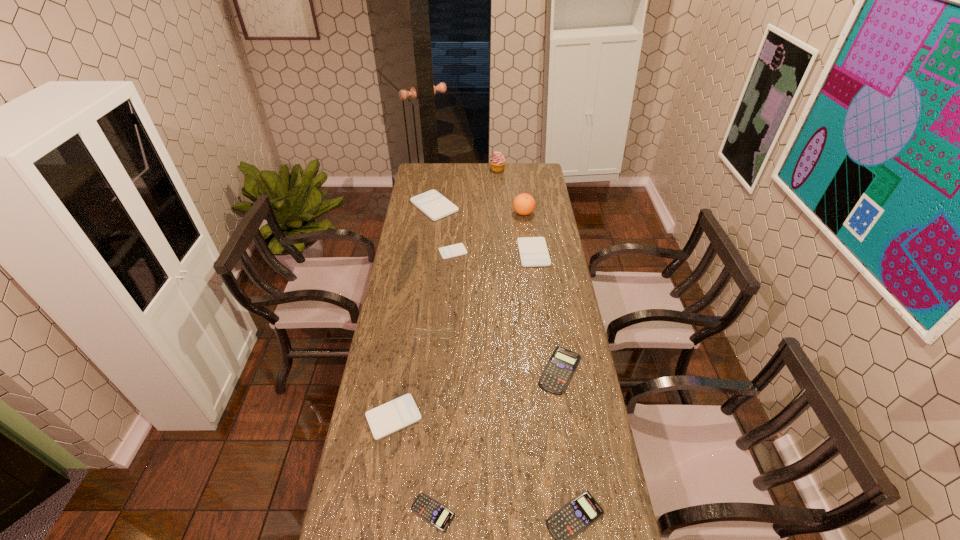
The image size is (960, 540). I want to click on calculator that stands as the fourth closest to the ninth tallest object, so click(533, 251).

Find the location of a particular element. This screenshot has height=540, width=960. calculator that stands as the second closest to the second biggest blue calculator is located at coordinates (560, 368).

Select which white calculator appears as the second closest to the orange orange. Please provide its 2D coordinates. Your answer should be formatted as a tuple, i.e. [(x, y)], where the tuple contains the x and y coordinates of a point satisfying the conditions above.

[(433, 204)]

Identify which white calculator is the fourth closest to the cupcake. Please provide its 2D coordinates. Your answer should be formatted as a tuple, i.e. [(x, y)], where the tuple contains the x and y coordinates of a point satisfying the conditions above.

[(392, 416)]

Find the location of `blue calculator identified as the third closest to the orange orange`. blue calculator identified as the third closest to the orange orange is located at coordinates (430, 510).

Identify which blue calculator is located as the second nearest to the farthest object. Please provide its 2D coordinates. Your answer should be formatted as a tuple, i.e. [(x, y)], where the tuple contains the x and y coordinates of a point satisfying the conditions above.

[(570, 520)]

The width and height of the screenshot is (960, 540). In order to click on free location that satisfies the following two spatial constraints: 1. on the back side of the cupcake; 2. on the right side of the smallest white calculator in this screenshot , I will do `click(459, 170)`.

Image resolution: width=960 pixels, height=540 pixels. Identify the location of free location that satisfies the following two spatial constraints: 1. on the front side of the shortest calculator; 2. on the right side of the seventh shortest object. (394, 512).

You are a GUI agent. You are given a task and a screenshot of the screen. Output one action in this format:
    pyautogui.click(x=<x>, y=<y>)
    Task: Click on the free space that satisfies the following two spatial constraints: 1. on the front side of the cupcake; 2. on the right side of the sixth shortest calculator
    The height and width of the screenshot is (540, 960).
    Given the screenshot: What is the action you would take?
    pyautogui.click(x=502, y=253)

Identify the location of vacant space that satisfies the following two spatial constraints: 1. on the front side of the smallest white calculator; 2. on the left side of the sixth shortest object. This screenshot has width=960, height=540. 453,253.